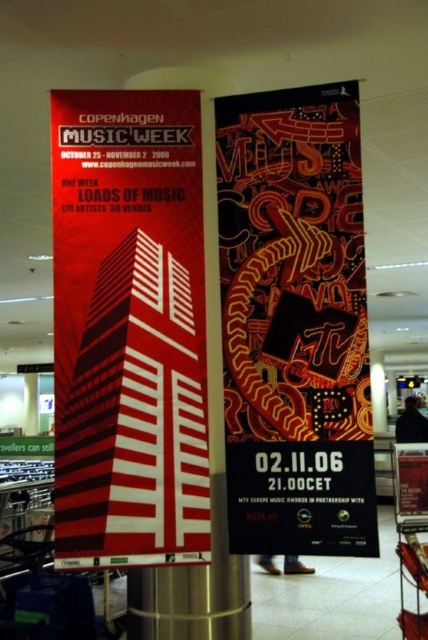
Looking at this image, is matte red building at center further to camera compared to matte black poster at center?

That is False.

Is point (189, 173) more distant than point (327, 291)?

Yes, it is behind point (327, 291).

Identify the location of matte red building at center. (128, 330).